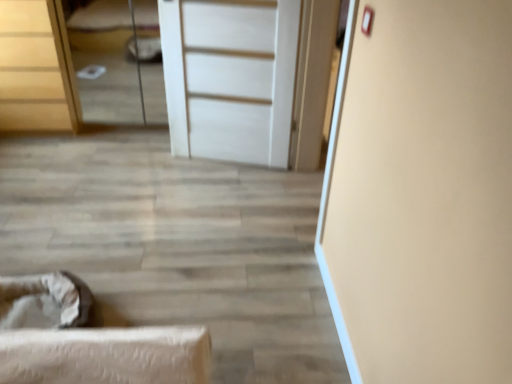
Locate an element on the screen. matte white bed at upper left is located at coordinates (105, 61).

Locate an element on the screen. The height and width of the screenshot is (384, 512). wooden chest of drawers at upper left is located at coordinates (36, 69).

The width and height of the screenshot is (512, 384). Identify the location of matte white bed at upper left. (105, 61).

From the image's perspective, is matte white bed at upper left positioned above or below white matte door at center?

matte white bed at upper left is above white matte door at center.

Are matte white bed at upper left and white matte door at center located far from each other?

Yes, matte white bed at upper left and white matte door at center are located far from each other.

Which point is more distant from viewer, [155,6] or [167,12]?

The point [155,6] is farther.

Does matte white bed at upper left have a lesser width compared to wooden chest of drawers at upper left?

Correct, the width of matte white bed at upper left is less than that of wooden chest of drawers at upper left.

From the image's perspective, is matte white bed at upper left located beneath wooden chest of drawers at upper left?

No, from the image's perspective, matte white bed at upper left is not below wooden chest of drawers at upper left.

Is matte white bed at upper left turned away from wooden chest of drawers at upper left?

matte white bed at upper left does not have its back to wooden chest of drawers at upper left.

Considering the sizes of objects matte white bed at upper left and wooden chest of drawers at upper left in the image provided, who is shorter, matte white bed at upper left or wooden chest of drawers at upper left?

With less height is wooden chest of drawers at upper left.

From the picture: Is wooden chest of drawers at upper left facing towards white matte door at center?

No, wooden chest of drawers at upper left does not turn towards white matte door at center.

Measure the distance from wooden chest of drawers at upper left to white matte door at center.

The distance of wooden chest of drawers at upper left from white matte door at center is 3.59 feet.

I want to click on the chest of drawers that is behind the white matte door at center, so tap(36, 69).

Would you say wooden chest of drawers at upper left is outside white matte door at center?

Yes, wooden chest of drawers at upper left is not within white matte door at center.

From their relative heights in the image, would you say white matte door at center is taller or shorter than matte white bed at upper left?

Considering their sizes, white matte door at center has more height than matte white bed at upper left.

Is there a large distance between white matte door at center and matte white bed at upper left?

Yes, white matte door at center and matte white bed at upper left are quite far apart.

Does white matte door at center come in front of matte white bed at upper left?

Yes.

From the image's perspective, is white matte door at center located above matte white bed at upper left?

No, from the image's perspective, white matte door at center is not on top of matte white bed at upper left.

Based on the photo, from a real-world perspective, is wooden chest of drawers at upper left on matte white bed at upper left?

Indeed, from a real-world perspective, wooden chest of drawers at upper left stands above matte white bed at upper left.

Which is more distant, (x=9, y=113) or (x=122, y=67)?

Point (x=122, y=67)

From the image's perspective, between wooden chest of drawers at upper left and matte white bed at upper left, which one is located above?

matte white bed at upper left is shown above in the image.

Considering the positions of objects white matte door at center and wooden chest of drawers at upper left in the image provided, who is in front, white matte door at center or wooden chest of drawers at upper left?

white matte door at center is in front.

Would you say wooden chest of drawers at upper left is part of white matte door at center's contents?

No, wooden chest of drawers at upper left is not a part of white matte door at center.

Which object is thinner, white matte door at center or wooden chest of drawers at upper left?

Thinner between the two is white matte door at center.

Locate an element on the screen. door that is in front of the wooden chest of drawers at upper left is located at coordinates (230, 77).

Locate an element on the screen. This screenshot has height=384, width=512. bed lying on the left of white matte door at center is located at coordinates pyautogui.click(x=105, y=61).

Locate an element on the screen. The image size is (512, 384). bed behind the wooden chest of drawers at upper left is located at coordinates (105, 61).

Which object lies nearer to the anchor point white matte door at center, matte white bed at upper left or wooden chest of drawers at upper left?

Among the two, wooden chest of drawers at upper left is located nearer to white matte door at center.

Based on their spatial positions, is matte white bed at upper left or white matte door at center further from wooden chest of drawers at upper left?

white matte door at center lies further to wooden chest of drawers at upper left than the other object.

Looking at the image, which one is located closer to matte white bed at upper left, white matte door at center or wooden chest of drawers at upper left?

Based on the image, wooden chest of drawers at upper left appears to be nearer to matte white bed at upper left.

Based on their spatial positions, is wooden chest of drawers at upper left or matte white bed at upper left closer to white matte door at center?

Among the two, wooden chest of drawers at upper left is located nearer to white matte door at center.

Consider the image. When comparing their distances from wooden chest of drawers at upper left, does white matte door at center or matte white bed at upper left seem further?

white matte door at center.

Considering their positions, is wooden chest of drawers at upper left positioned closer to matte white bed at upper left than white matte door at center?

wooden chest of drawers at upper left.

In order to click on bed between wooden chest of drawers at upper left and white matte door at center from left to right in this screenshot , I will do (x=105, y=61).